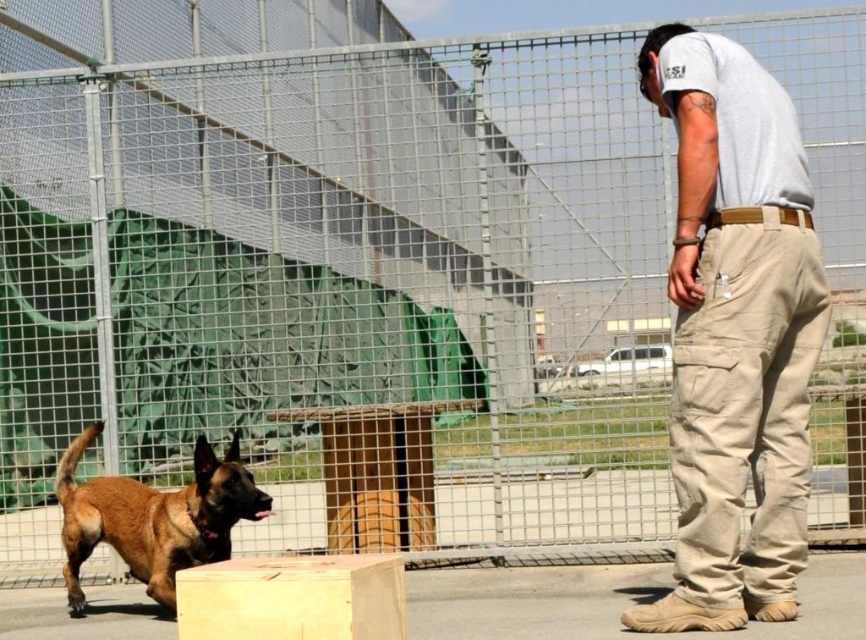
Question: Among these objects, which one is nearest to the camera?

Choices:
 (A) khaki cotton pants at right
 (B) light brown wood at center

Answer: (B)

Question: Which of the following is the closest to the observer?

Choices:
 (A) khaki cotton pants at right
 (B) light brown wood at center

Answer: (B)

Question: Which object is the farthest from the khaki cotton pants at right?

Choices:
 (A) brown fur dog at left
 (B) light brown wood at center

Answer: (A)

Question: Does brown fur dog at left have a greater width compared to light brown wood at center?

Choices:
 (A) no
 (B) yes

Answer: (B)

Question: Can you confirm if khaki cotton pants at right is bigger than brown fur dog at left?

Choices:
 (A) yes
 (B) no

Answer: (A)

Question: Where is brown fur dog at left located in relation to light brown wood at center in the image?

Choices:
 (A) right
 (B) left

Answer: (B)